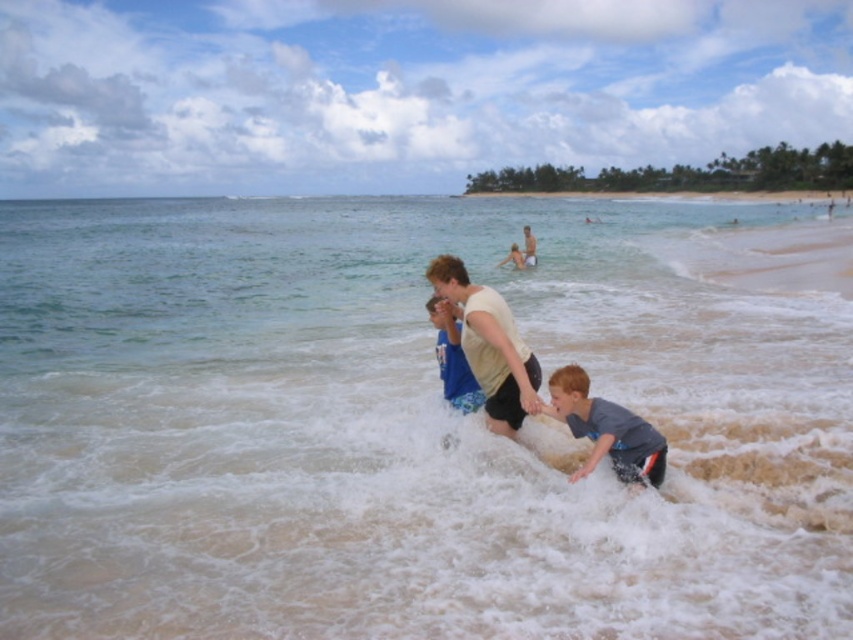
Question: Where is light beige cotton shirt at center located in relation to gray matte shirt at lower right in the image?

Choices:
 (A) above
 (B) below

Answer: (A)

Question: Does light beige cotton shirt at center appear on the right side of light blue fabric shirt at center?

Choices:
 (A) no
 (B) yes

Answer: (A)

Question: Which object is farther from the camera taking this photo?

Choices:
 (A) light beige cotton shirt at center
 (B) clear water at center
 (C) gray matte shirt at lower right
 (D) light blue fabric shirt at center

Answer: (D)

Question: Considering the real-world distances, which object is farthest from the gray matte shirt at lower right?

Choices:
 (A) light beige cotton shirt at center
 (B) light blue fabric shirt at center
 (C) clear water at center

Answer: (C)

Question: Does clear water at center appear on the left side of light beige cotton shirt at center?

Choices:
 (A) no
 (B) yes

Answer: (B)

Question: Based on their relative distances, which object is nearer to the gray matte shirt at lower right?

Choices:
 (A) clear water at center
 (B) light blue fabric shirt at center
 (C) light beige cotton shirt at center

Answer: (C)